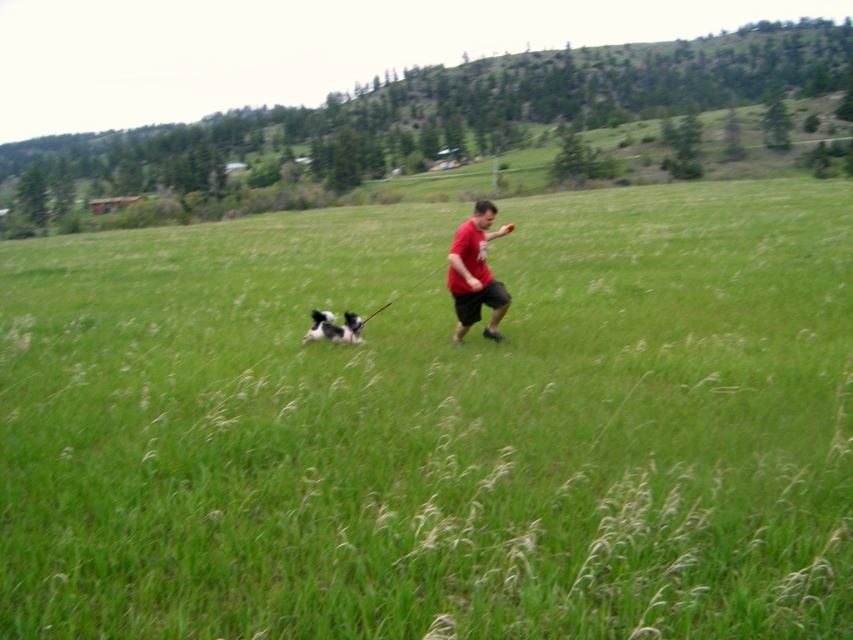
You are a photographer trying to capture the entire scene of the green grassy field at center and the black and white fur at center in one shot. Based on their sizes, which object should you focus on to ensure both are visible in the frame?

The green grassy field at center is larger in size than the black and white fur at center, so focusing on the green grassy field at center will ensure both objects are visible in the frame.